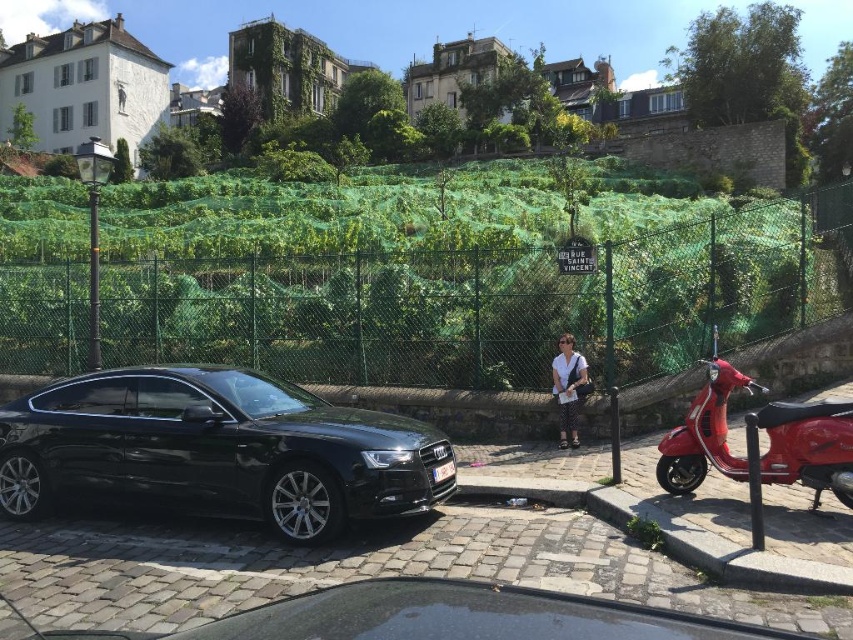
Who is positioned more to the right, green mesh fence at center or white cotton shirt at center?

white cotton shirt at center is more to the right.

Image resolution: width=853 pixels, height=640 pixels. I want to click on green mesh fence at center, so click(491, 301).

Does shiny red scooter at right appear under white cotton shirt at center?

Correct, shiny red scooter at right is located below white cotton shirt at center.

Does shiny red scooter at right have a lesser height compared to white cotton shirt at center?

Yes.

The height and width of the screenshot is (640, 853). What do you see at coordinates (808, 445) in the screenshot?
I see `shiny red scooter at right` at bounding box center [808, 445].

Where is `shiny red scooter at right`? The image size is (853, 640). shiny red scooter at right is located at coordinates (808, 445).

Is shiny black sedan at lower left shorter than white cotton shirt at center?

Yes, shiny black sedan at lower left is shorter than white cotton shirt at center.

Find the location of a particular element. shiny black sedan at lower left is located at coordinates (219, 449).

The width and height of the screenshot is (853, 640). What do you see at coordinates (219, 449) in the screenshot?
I see `shiny black sedan at lower left` at bounding box center [219, 449].

Where is `shiny black sedan at lower left`? The height and width of the screenshot is (640, 853). shiny black sedan at lower left is located at coordinates (219, 449).